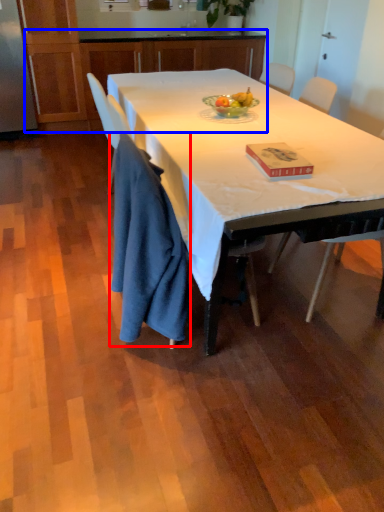
Question: Which point is closer to the camera, cloth (highlighted by a red box) or cabinetry (highlighted by a blue box)?

Choices:
 (A) cloth
 (B) cabinetry

Answer: (A)